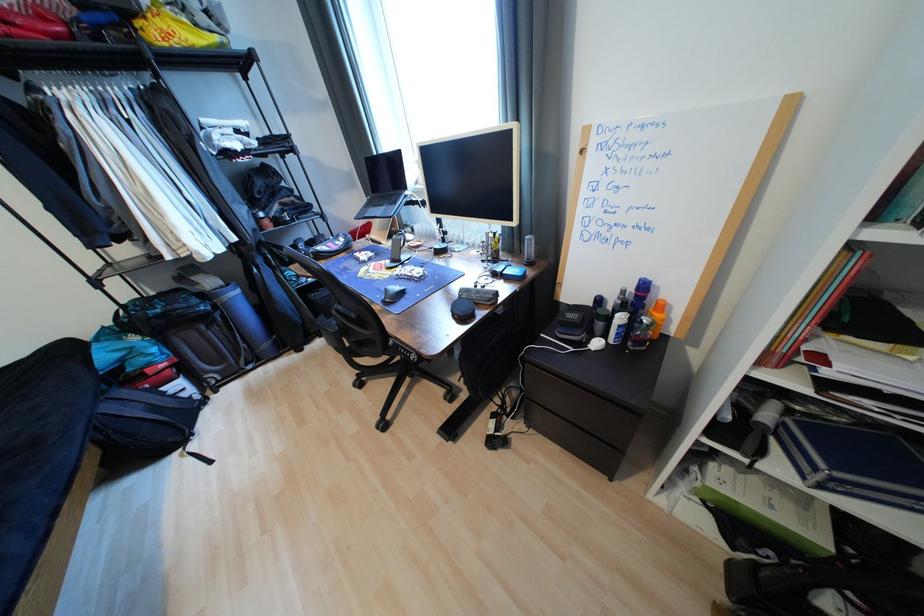
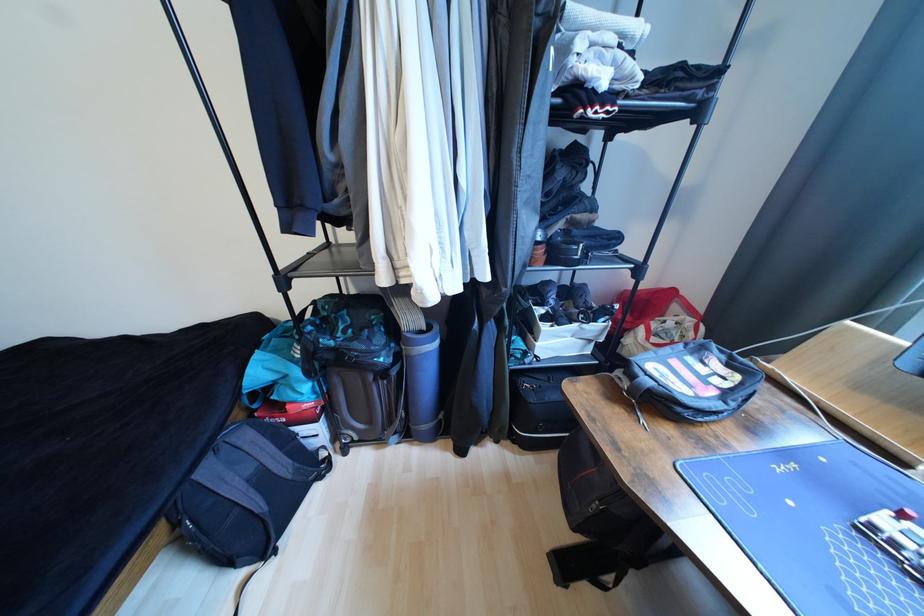
Find the pixel in the second image that matches [116,408] in the first image.

(215, 472)